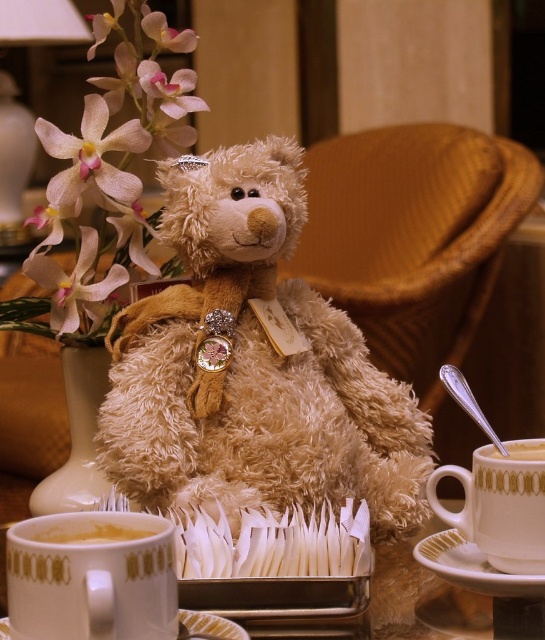
Who is positioned more to the right, fuzzy beige teddy bear at center or soft pink silk flower at upper left?

Positioned to the right is fuzzy beige teddy bear at center.

Between point (296, 493) and point (17, 321), which one is positioned in front?

Positioned in front is point (296, 493).

Find the location of a particular element. Image resolution: width=545 pixels, height=640 pixels. fuzzy beige teddy bear at center is located at coordinates (252, 365).

Can you confirm if gold-golden teacup at lower left is positioned above golden ceramic cup at lower right?

No, gold-golden teacup at lower left is not above golden ceramic cup at lower right.

Consider the image. Who is lower down, gold-golden teacup at lower left or golden ceramic cup at lower right?

gold-golden teacup at lower left

Is point (39, 525) positioned behind point (524, 456)?

No, (39, 525) is in front of (524, 456).

This screenshot has width=545, height=640. I want to click on gold-golden teacup at lower left, so click(x=92, y=577).

Which is below, gold-patterned ceramic cup at right or golden ceramic cup at lower right?

Positioned lower is gold-patterned ceramic cup at right.

Who is positioned more to the right, gold-patterned ceramic cup at right or golden ceramic cup at lower right?

golden ceramic cup at lower right is more to the right.

What do you see at coordinates (500, 504) in the screenshot?
I see `gold-patterned ceramic cup at right` at bounding box center [500, 504].

Locate an element on the screen. Image resolution: width=545 pixels, height=640 pixels. gold-patterned ceramic cup at right is located at coordinates (500, 504).